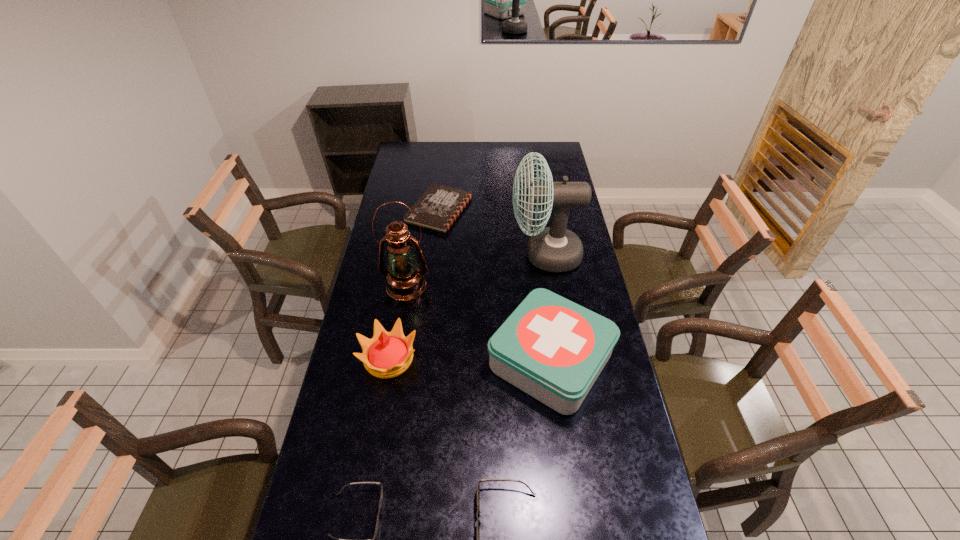
Locate an element on the screen. Image resolution: width=960 pixels, height=540 pixels. free space at the right edge of the desktop is located at coordinates (591, 265).

The width and height of the screenshot is (960, 540). I want to click on vacant space at the far right corner of the desktop, so tap(559, 152).

This screenshot has height=540, width=960. In order to click on vacant area that lies between the crown and the first-aid kit in this screenshot , I will do `click(469, 360)`.

Locate an element on the screen. The image size is (960, 540). object that ranks as the closest to the crown is located at coordinates (405, 281).

Point out which object is positioned as the nearest to the notebook. Please provide its 2D coordinates. Your answer should be formatted as a tuple, i.e. [(x, y)], where the tuple contains the x and y coordinates of a point satisfying the conditions above.

[(554, 249)]